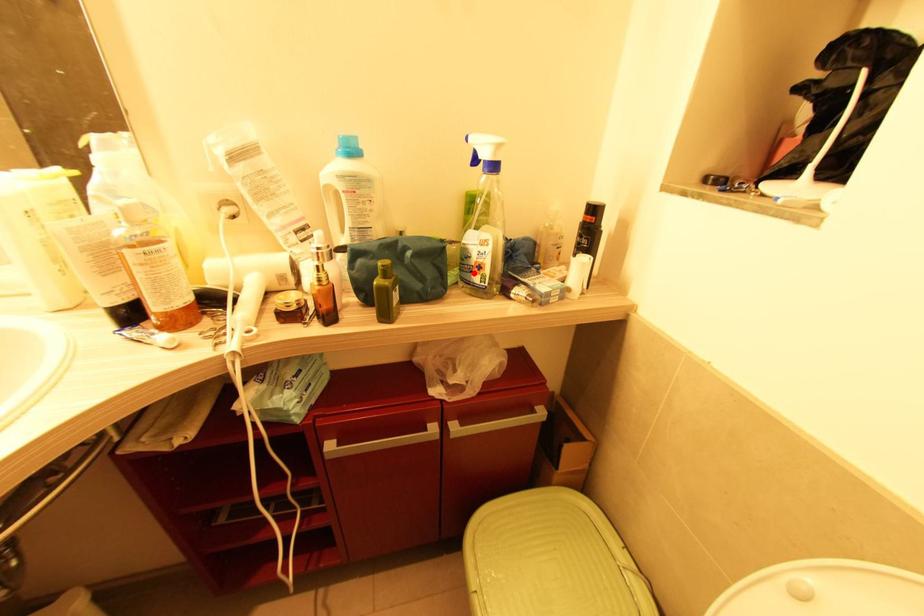
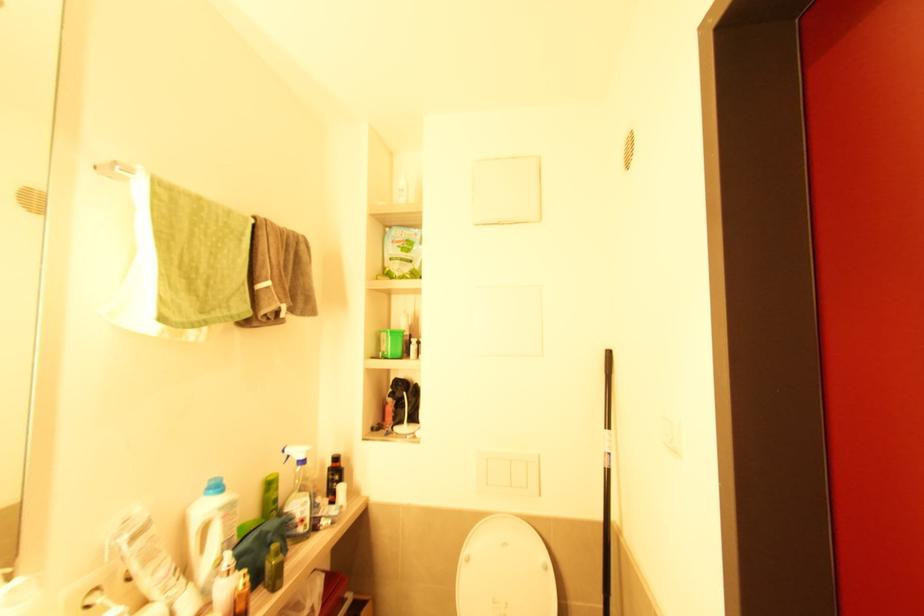
Find the pixel in the second image that matches the highlighted location in the first image.

(298, 527)